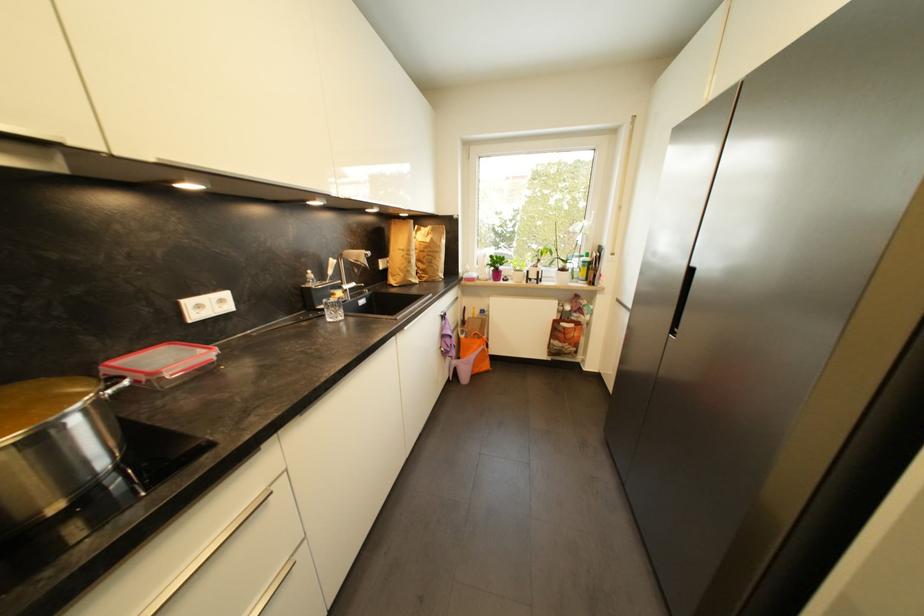
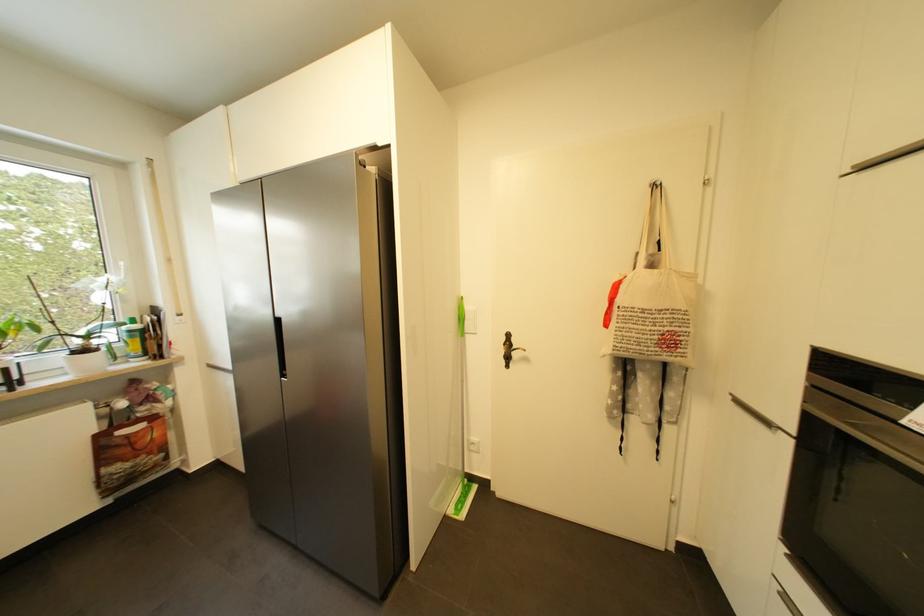
Question: How did the camera likely rotate?

Choices:
 (A) Left
 (B) Right
 (C) Up
 (D) Down

Answer: (B)